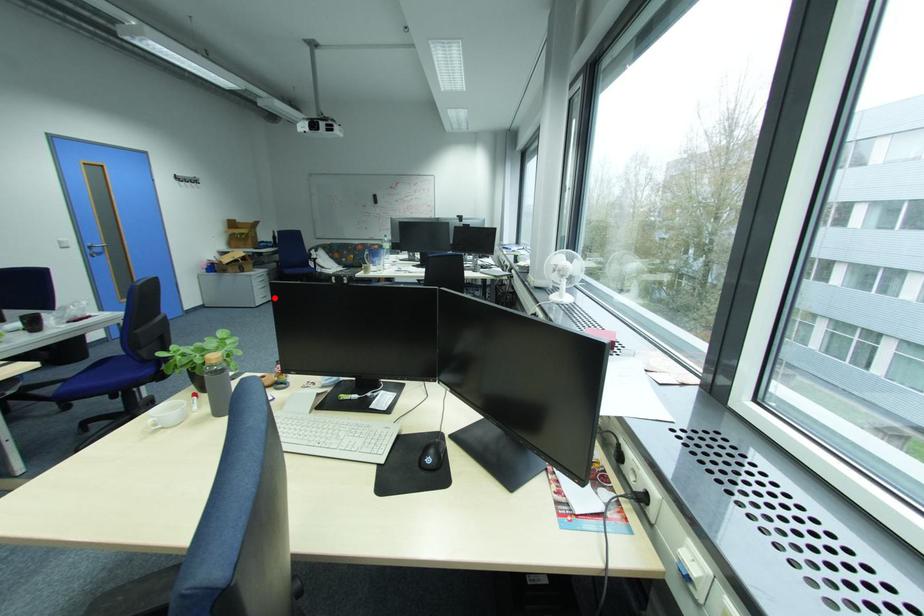
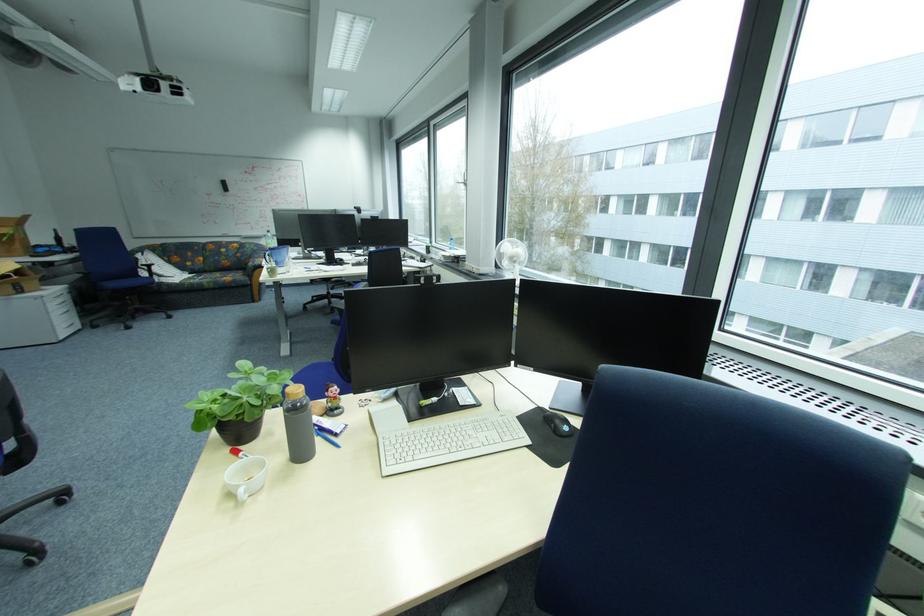
The point at the highlighted location is marked in the first image. Where is the corresponding point in the second image?

(80, 326)